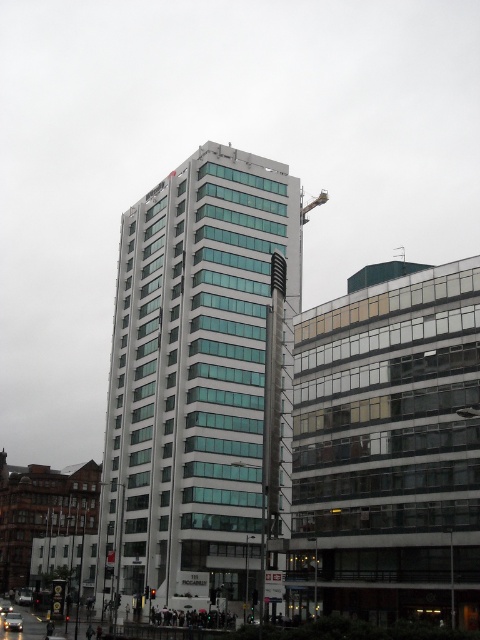
You are a delivery driver who needs to park your metallic silver car at center in a spot that is exactly 15 meters away from the metallic silver car at lower left. Based on the scene, can you park your car in the desired spot?

The distance between the metallic silver car at center and the metallic silver car at lower left is 15.59 meters. Since the required distance is 15 meters, the current position is slightly farther than needed. You might need to adjust your parking spot to be closer to the metallic silver car at lower left by approximately 0.59 meters to meet the requirement.

You are a pedestrian standing in the middle of the street looking at the two metallic silver cars. Which car is nearer to you, the metallic silver car at center or the metallic silver car at lower left?

The metallic silver car at center is closer to the viewer than the metallic silver car at lower left, so the metallic silver car at center is nearer to you.